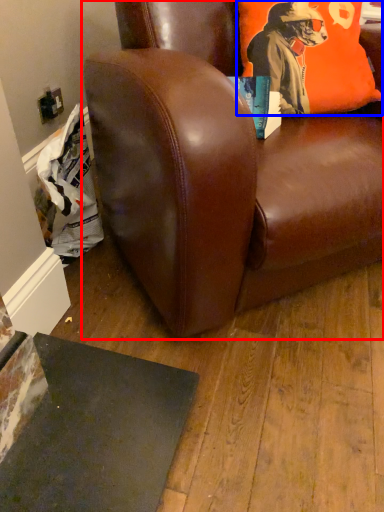
Question: Which object is closer to the camera taking this photo, chair (highlighted by a red box) or pillow (highlighted by a blue box)?

Choices:
 (A) chair
 (B) pillow

Answer: (A)